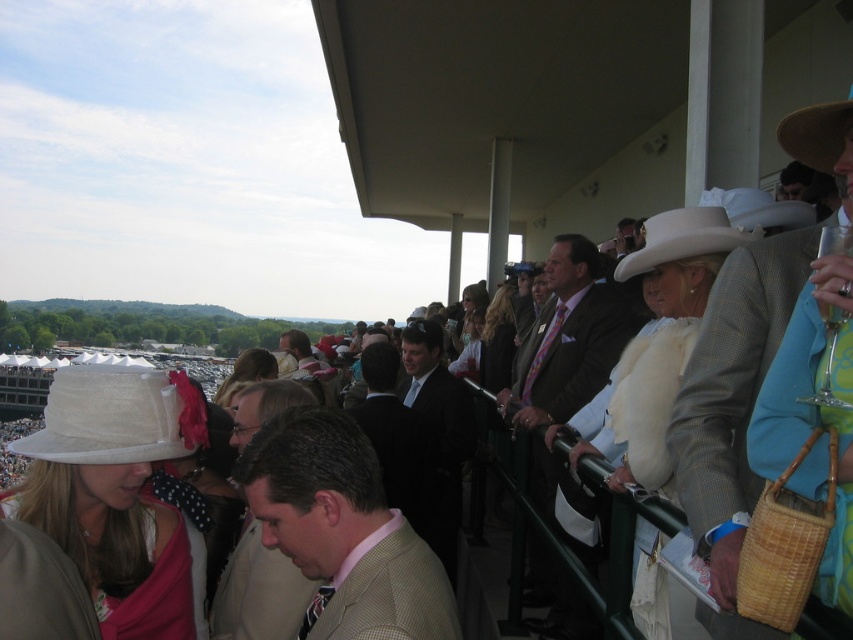
Who is taller, matte brown suit at center or black suit at center?

matte brown suit at center is taller.

Measure the distance between matte brown suit at center and camera.

140.35 feet

Who is more distant from viewer, (555,410) or (434,404)?

The point (434,404) is more distant.

Locate an element on the screen. matte brown suit at center is located at coordinates (572, 337).

Is white felt cowboy hat at upper right closer to camera compared to brown straw cowboy hat at upper right?

No.

Which is behind, point (714, 205) or point (824, 145)?

Point (714, 205)

Which is behind, point (701, 221) or point (784, 129)?

Positioned behind is point (701, 221).

Find the location of a particular element. white felt cowboy hat at upper right is located at coordinates (683, 237).

Is matte brown suit at center smaller than white felt cowboy hat at upper right?

No, matte brown suit at center is not smaller than white felt cowboy hat at upper right.

This screenshot has width=853, height=640. In order to click on matte brown suit at center in this screenshot , I will do `click(572, 337)`.